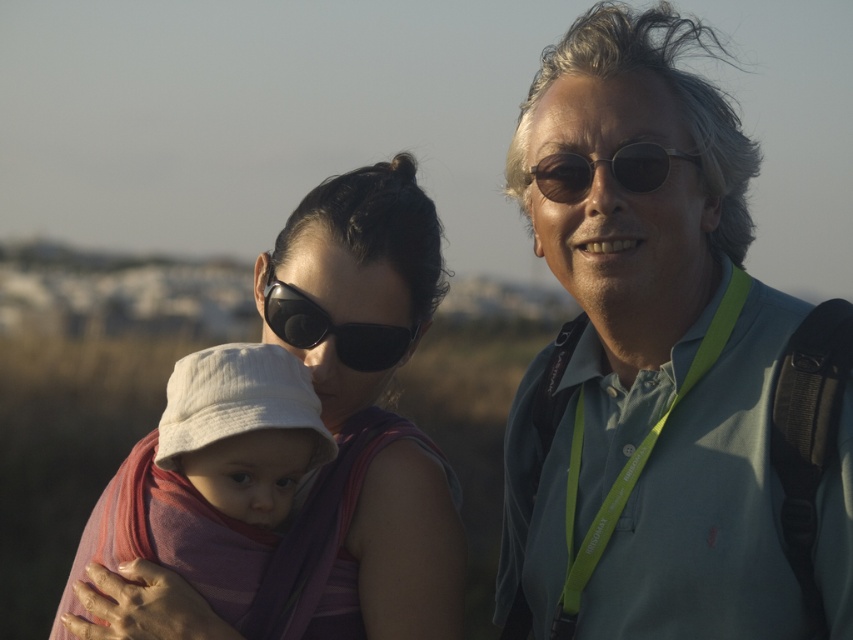
Question: Does matte gray hair at upper right appear over sunglasses at center?

Choices:
 (A) yes
 (B) no

Answer: (B)

Question: Observing the image, what is the correct spatial positioning of black matte sunglasses at center in reference to sunglasses at center?

Choices:
 (A) above
 (B) below

Answer: (B)

Question: Which of the following is the closest to the observer?

Choices:
 (A) (584, 275)
 (B) (289, 333)

Answer: (A)

Question: Which point is closer to the camera taking this photo?

Choices:
 (A) pyautogui.click(x=628, y=221)
 (B) pyautogui.click(x=219, y=404)
 (C) pyautogui.click(x=582, y=188)
 (D) pyautogui.click(x=370, y=248)

Answer: (A)

Question: Which object is closer to the camera taking this photo?

Choices:
 (A) black matte sunglasses at center
 (B) sunglasses at center
 (C) matte gray hair at upper right
 (D) matte purple fabric at center

Answer: (B)

Question: Is matte gray hair at upper right positioned at the back of sunglasses at center?

Choices:
 (A) yes
 (B) no

Answer: (A)